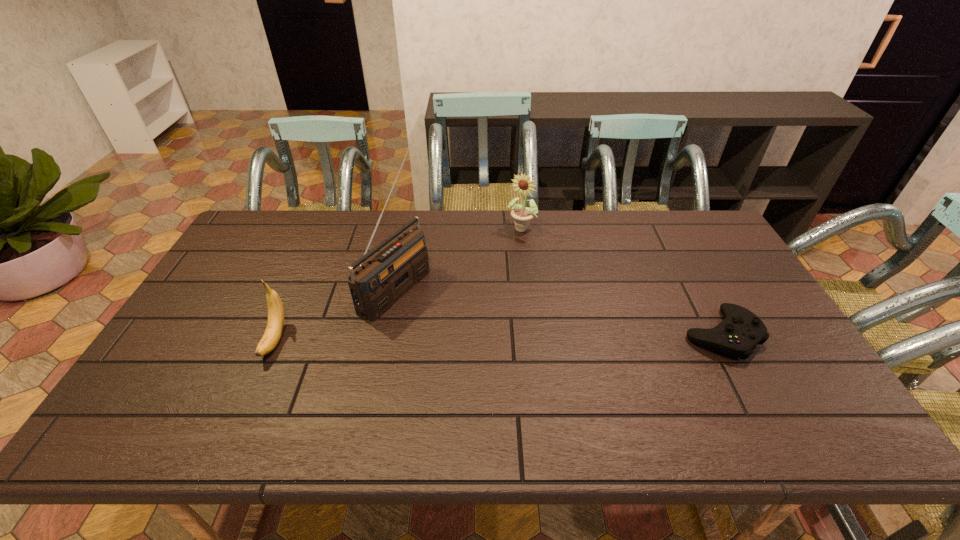
Identify the location of vacant region located 0.330m on the front-facing side of the tallest object. [520, 355].

This screenshot has width=960, height=540. In order to click on vacant point located on the front-facing side of the tallest object in this screenshot , I will do `click(494, 342)`.

This screenshot has height=540, width=960. In order to click on vacant space situated 0.070m on the front-facing side of the tallest object in this screenshot , I will do `click(440, 315)`.

This screenshot has width=960, height=540. I want to click on vacant region located on the front-facing side of the farthest object, so click(484, 281).

Where is `free space located on the front-facing side of the farthest object`? free space located on the front-facing side of the farthest object is located at coordinates (475, 294).

In order to click on vacant space situated on the front-facing side of the farthest object in this screenshot , I will do 497,265.

Identify the location of object present at the far edge. pyautogui.click(x=522, y=215).

At what (x,y) coordinates should I click in order to perform the action: click on object situated at the right edge. Please return your answer as a coordinate pair (x, y). Image resolution: width=960 pixels, height=540 pixels. Looking at the image, I should click on (741, 330).

Identify the location of blank space at the far edge of the desktop. (452, 243).

Where is `vacant space at the near edge of the desktop`? vacant space at the near edge of the desktop is located at coordinates (479, 377).